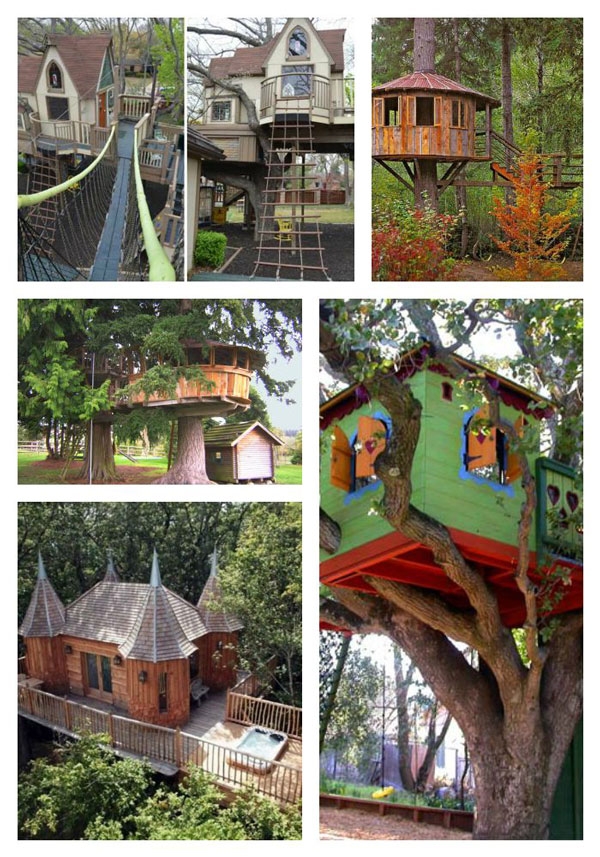
Where is `bench`? The image size is (600, 857). bench is located at coordinates (212, 694).